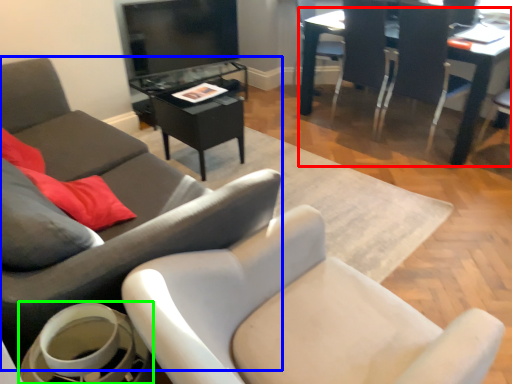
Question: Estimate the real-world distances between objects in this image. Which object is farther from table (highlighted by a red box), chair (highlighted by a blue box) or round table (highlighted by a green box)?

Choices:
 (A) chair
 (B) round table

Answer: (B)